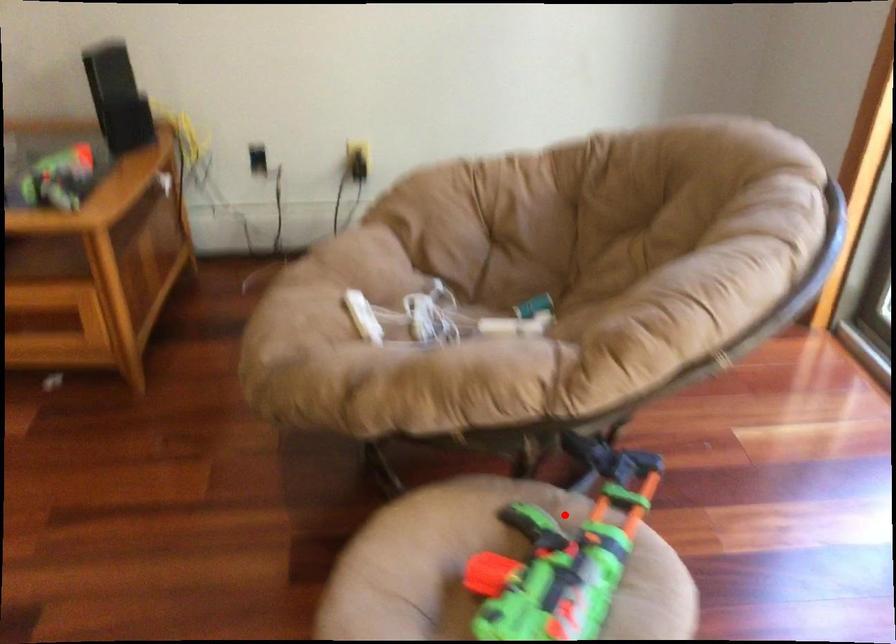
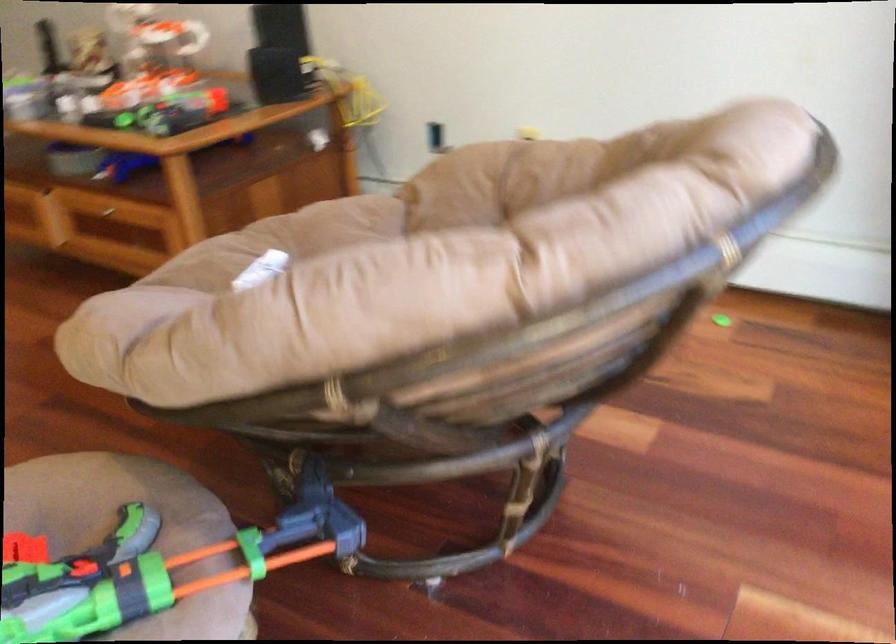
Find the pixel in the second image that matches the highlighted location in the first image.

(134, 527)